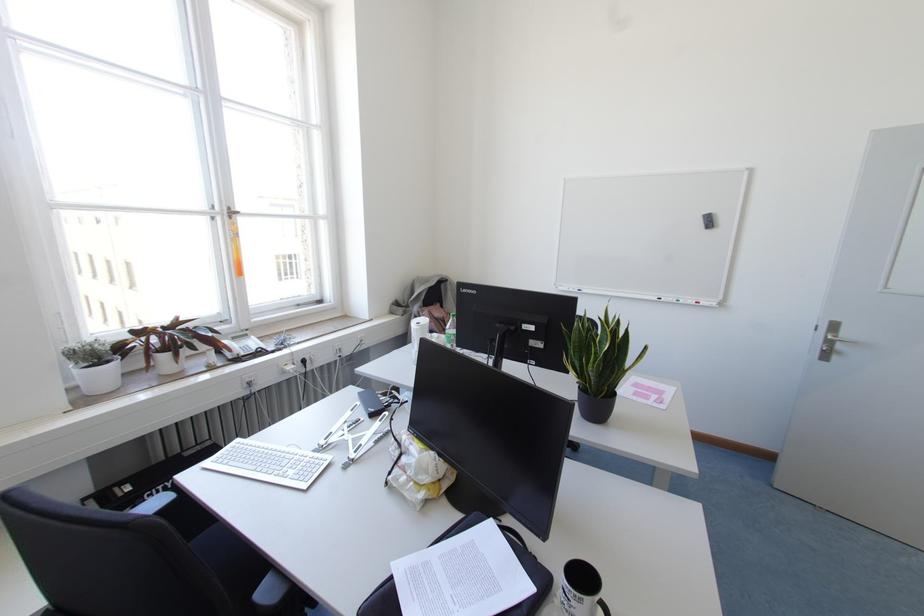
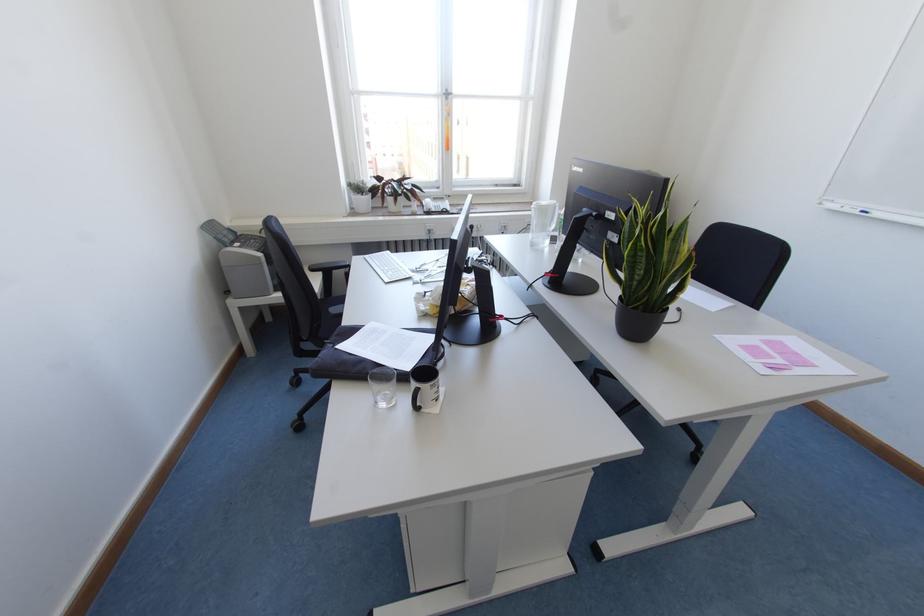
The point at (578,290) is marked in the first image. Where is the corresponding point in the second image?

(864, 213)